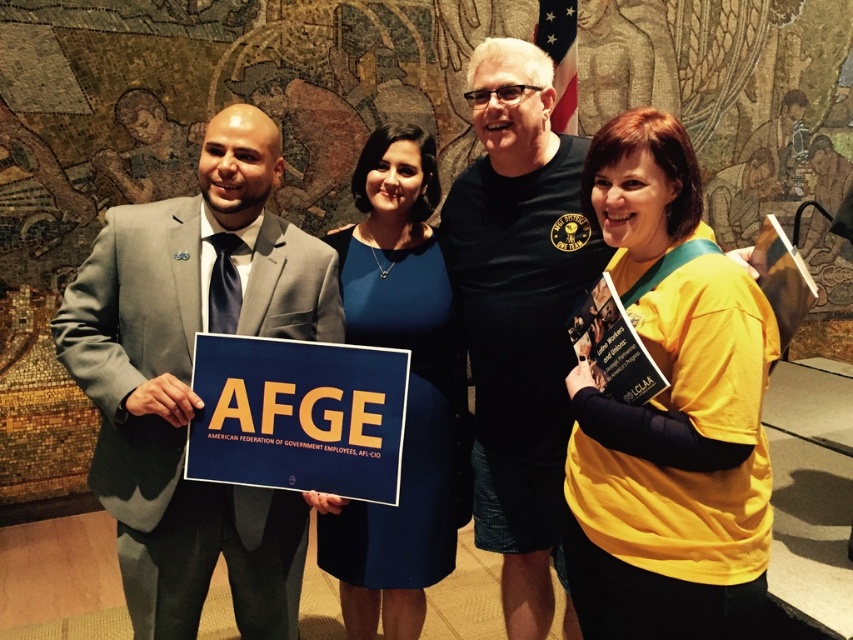
Does blue fabric dress at center come behind yellow paper sign at center?

Yes, blue fabric dress at center is further from the viewer.

Is point (366, 278) positioned in front of point (357, 384)?

No, (366, 278) is behind (357, 384).

I want to click on blue fabric dress at center, so click(x=407, y=392).

Is matte gray suit at left bigger than yellow jersey at center?

Correct, matte gray suit at left is larger in size than yellow jersey at center.

Is point (190, 593) positioned after point (654, 556)?

Yes, it is behind point (654, 556).

Between point (106, 474) and point (648, 195), which one is positioned in front?

Point (648, 195)

Image resolution: width=853 pixels, height=640 pixels. I want to click on matte gray suit at left, so click(x=189, y=380).

Does matte gray suit at left have a greater width compared to blue fabric dress at center?

Yes, matte gray suit at left is wider than blue fabric dress at center.

Is matte gray suit at left shorter than blue fabric dress at center?

Yes.

Identify the location of matte gray suit at left. (189, 380).